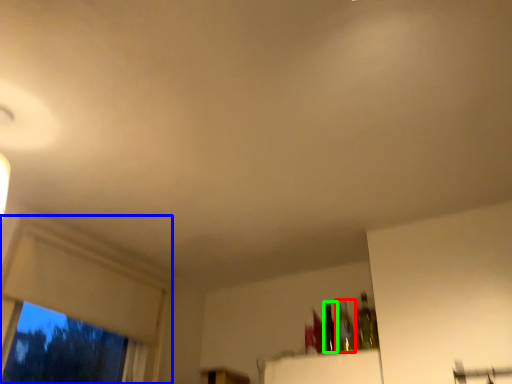
Question: Which object is the farthest from bottle (highlighted by a red box)? Choose among these: window frame (highlighted by a blue box) or bottle (highlighted by a green box).

Choices:
 (A) window frame
 (B) bottle

Answer: (A)